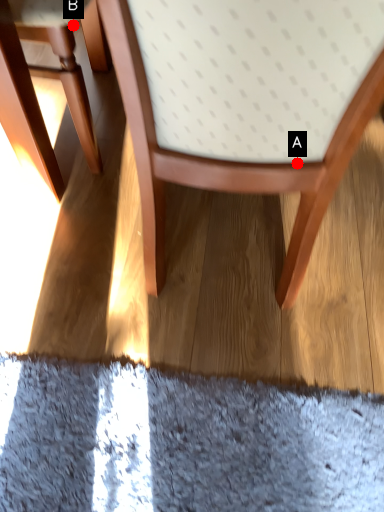
Question: Two points are circled on the image, labeled by A and B beside each circle. Which of the following is the farthest from the observer?

Choices:
 (A) A is further
 (B) B is further

Answer: (B)